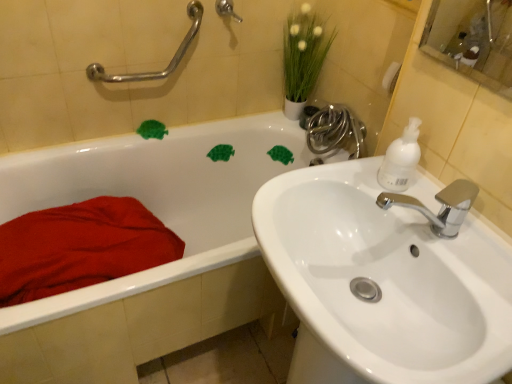
Question: Looking at the image, does shiny chrome faucet at upper right seem bigger or smaller compared to white matte soap dispenser at upper right?

Choices:
 (A) big
 (B) small

Answer: (A)

Question: Considering the relative positions of shiny chrome faucet at upper right and white matte soap dispenser at upper right in the image provided, is shiny chrome faucet at upper right to the left or to the right of white matte soap dispenser at upper right?

Choices:
 (A) right
 (B) left

Answer: (B)

Question: Which object is the closest to the white glossy bathtub at upper left?

Choices:
 (A) white glossy sink at right
 (B) silver metallic grab bar at upper left, which is the 1th shower in left-to-right order
 (C) brushed metal shower handle at upper center, which is the first shower in right-to-left order
 (D) red cotton blanket at lower left
 (E) green matte plant at upper center

Answer: (D)

Question: Which is farther from the red cotton blanket at lower left?

Choices:
 (A) shiny chrome faucet at upper right
 (B) silver metallic grab bar at upper left, which is the 1th shower in left-to-right order
 (C) white glossy sink at right
 (D) brushed metal shower handle at upper center, the second shower when ordered from left to right
 (E) white matte soap dispenser at upper right

Answer: (E)